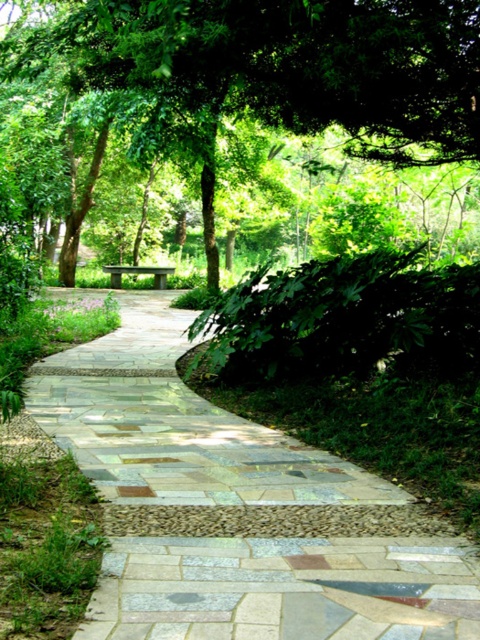
Question: Is natural stone pathway at center smaller than green stone bench at center?

Choices:
 (A) no
 (B) yes

Answer: (A)

Question: Among these points, which one is farthest from the camera?

Choices:
 (A) (109, 264)
 (B) (190, 97)

Answer: (A)

Question: Which of the following is the closest to the observer?

Choices:
 (A) (155, 282)
 (B) (213, 54)

Answer: (B)

Question: Can you confirm if green leafy tree at center is positioned above green stone bench at center?

Choices:
 (A) yes
 (B) no

Answer: (A)

Question: Which of the following is the farthest from the observer?

Choices:
 (A) (149, 541)
 (B) (84, 6)
 (C) (163, 269)

Answer: (C)

Question: Can you confirm if natural stone pathway at center is positioned to the left of green leafy tree at center?

Choices:
 (A) no
 (B) yes

Answer: (A)